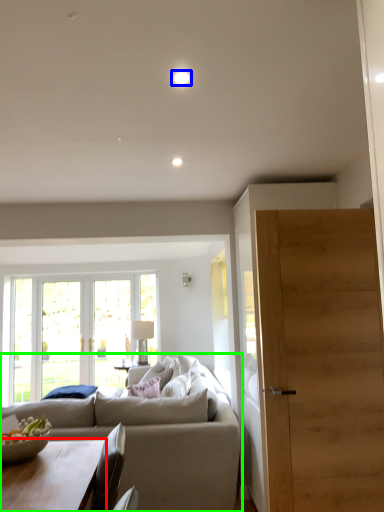
Question: Which object is the farthest from coffee table (highlighted by a red box)? Choose among these: light (highlighted by a blue box) or studio couch (highlighted by a green box).

Choices:
 (A) light
 (B) studio couch

Answer: (A)